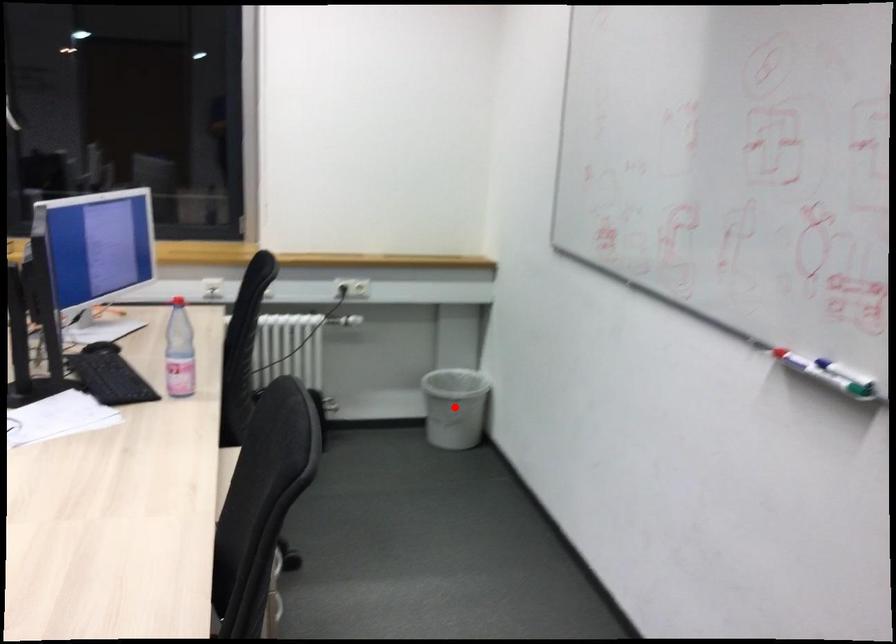
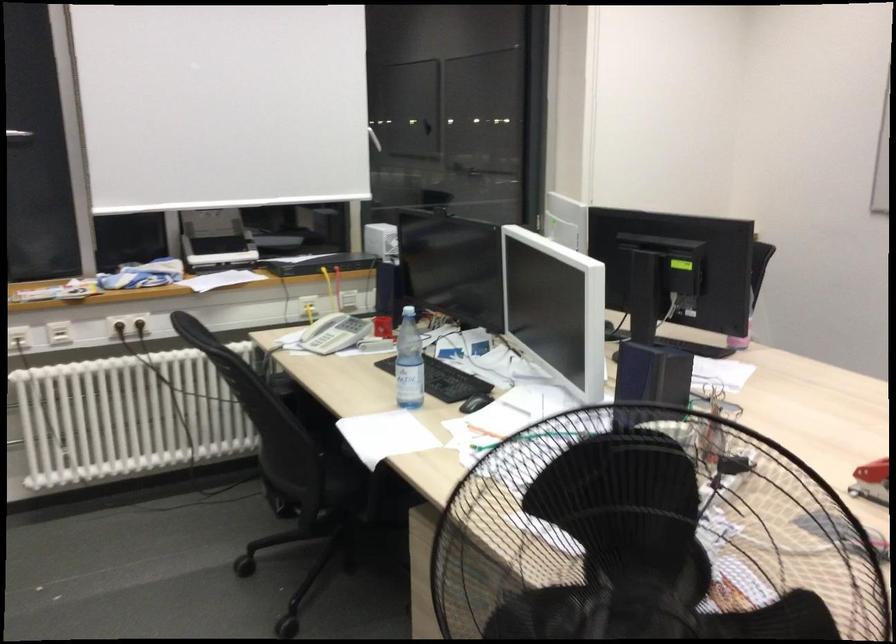
Question: I am providing you with two images of the same scene from different viewpoints. A red point is marked on the first image. At the location where the point appears in image 1, is it still visible in image 2?

Choices:
 (A) Yes
 (B) No

Answer: (B)